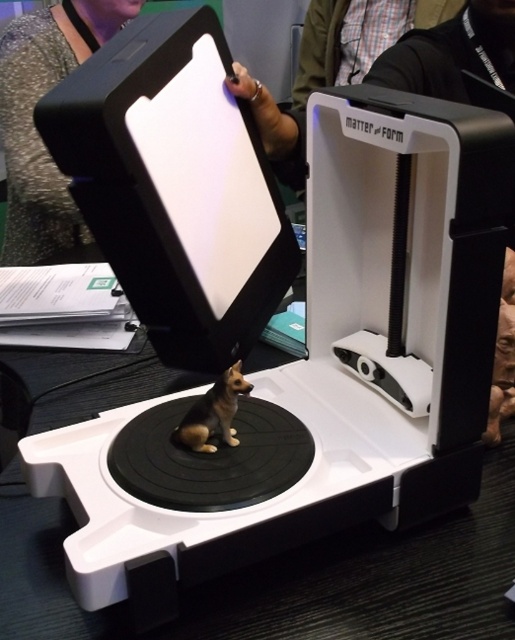
Question: Is sparkly silver shirt at upper left above brown matte dog at center?

Choices:
 (A) no
 (B) yes

Answer: (B)

Question: In this image, where is sparkly silver shirt at upper left located relative to brown matte dog at center?

Choices:
 (A) below
 (B) above

Answer: (B)

Question: Which point appears farthest from the camera in this image?

Choices:
 (A) (235, 444)
 (B) (52, 218)

Answer: (B)

Question: Which point is farther to the camera?

Choices:
 (A) sparkly silver shirt at upper left
 (B) brown matte dog at center

Answer: (A)

Question: Is the position of sparkly silver shirt at upper left more distant than that of brown matte dog at center?

Choices:
 (A) yes
 (B) no

Answer: (A)